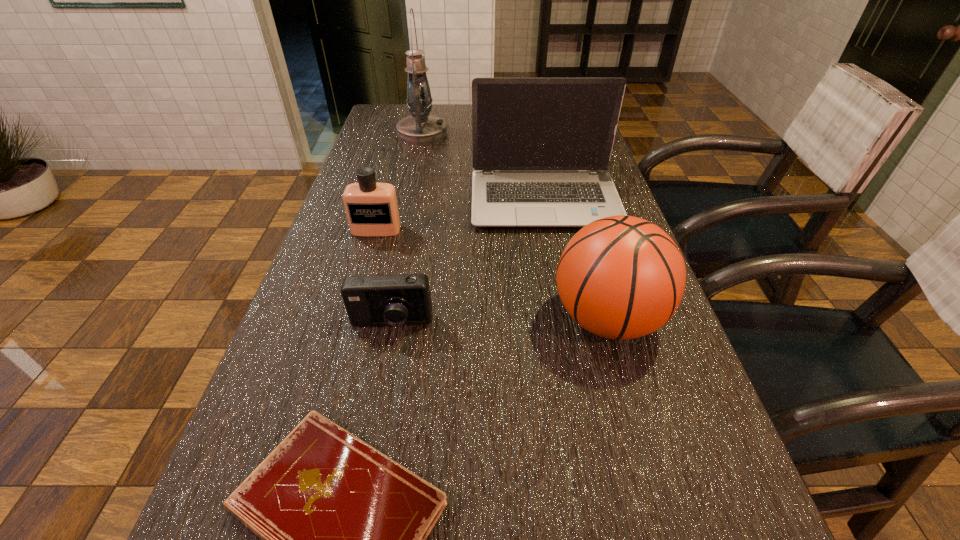
Find the location of a particular element. vacant space situated on the front-facing side of the second shortest object is located at coordinates (383, 368).

Image resolution: width=960 pixels, height=540 pixels. What are the coordinates of `object that is at the far edge` in the screenshot? It's located at (421, 128).

Image resolution: width=960 pixels, height=540 pixels. What are the coordinates of `oil lamp present at the left edge` in the screenshot? It's located at (421, 128).

At what (x,y) coordinates should I click in order to perform the action: click on perfume situated at the left edge. Please return your answer as a coordinate pair (x, y). The image size is (960, 540). Looking at the image, I should click on (372, 210).

Image resolution: width=960 pixels, height=540 pixels. In order to click on camera present at the left edge in this screenshot , I will do `click(380, 300)`.

You are a GUI agent. You are given a task and a screenshot of the screen. Output one action in this format:
    pyautogui.click(x=<x>, y=<y>)
    Task: Click on the laptop computer present at the right edge
    
    Given the screenshot: What is the action you would take?
    pyautogui.click(x=541, y=147)

Identify the location of basketball that is at the right edge. (621, 277).

Locate an element on the screen. object that is at the far left corner is located at coordinates (421, 128).

Locate an element on the screen. The image size is (960, 540). blank space at the far edge of the desktop is located at coordinates (447, 106).

Find the location of a particular element. The height and width of the screenshot is (540, 960). vacant space at the left edge of the desktop is located at coordinates (366, 338).